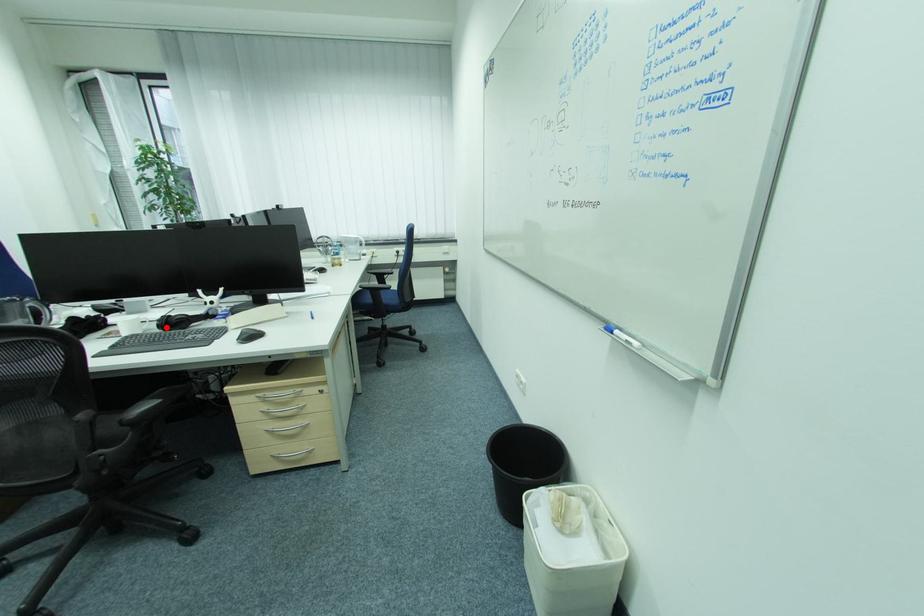
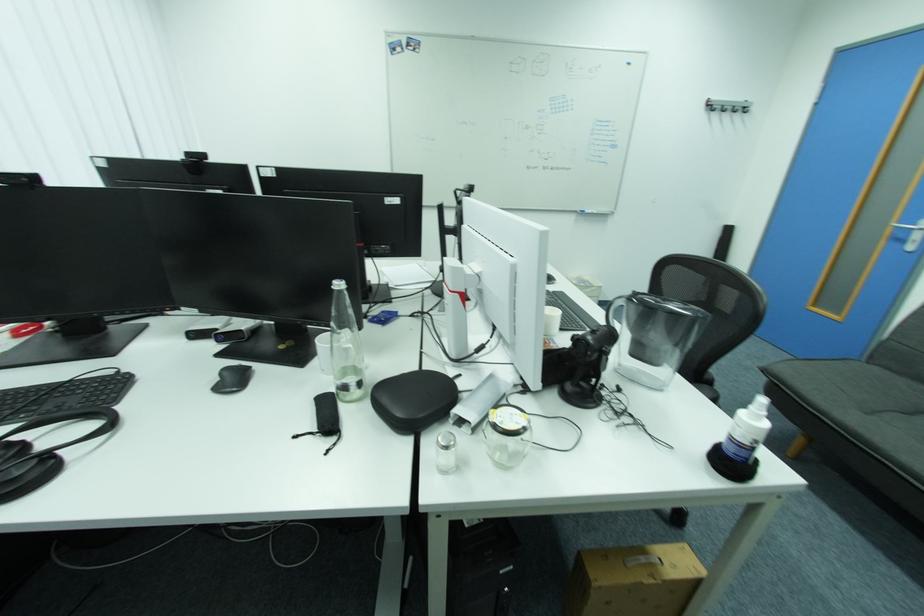
Question: I am providing you with two images of the same scene from different viewpoints. A red point is marked on the first image. Can you still see the location of the red point in image 2?

Choices:
 (A) Yes
 (B) No

Answer: (B)